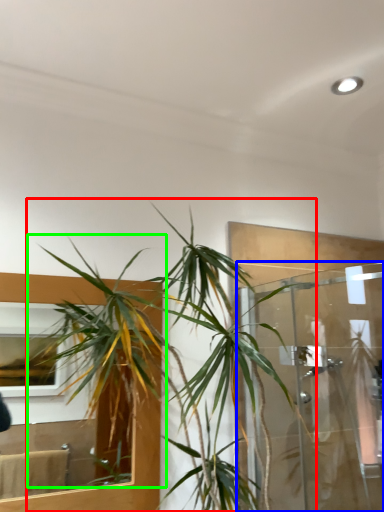
Question: Which object is positioned closest to houseplant (highlighted by a red box)? Select from glass door (highlighted by a blue box) and vegetation (highlighted by a green box).

Choices:
 (A) glass door
 (B) vegetation

Answer: (B)